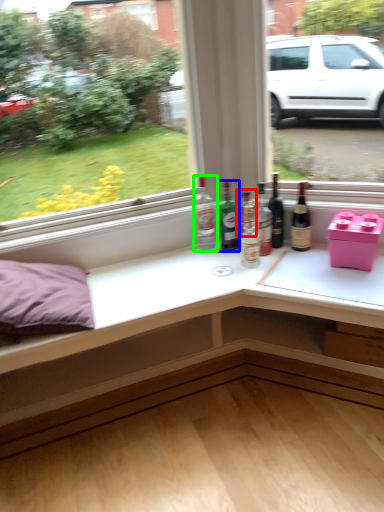
Question: Which object is the closest to the bottle (highlighted by a red box)? Choose among these: bottle (highlighted by a blue box) or bottle (highlighted by a green box).

Choices:
 (A) bottle
 (B) bottle

Answer: (A)